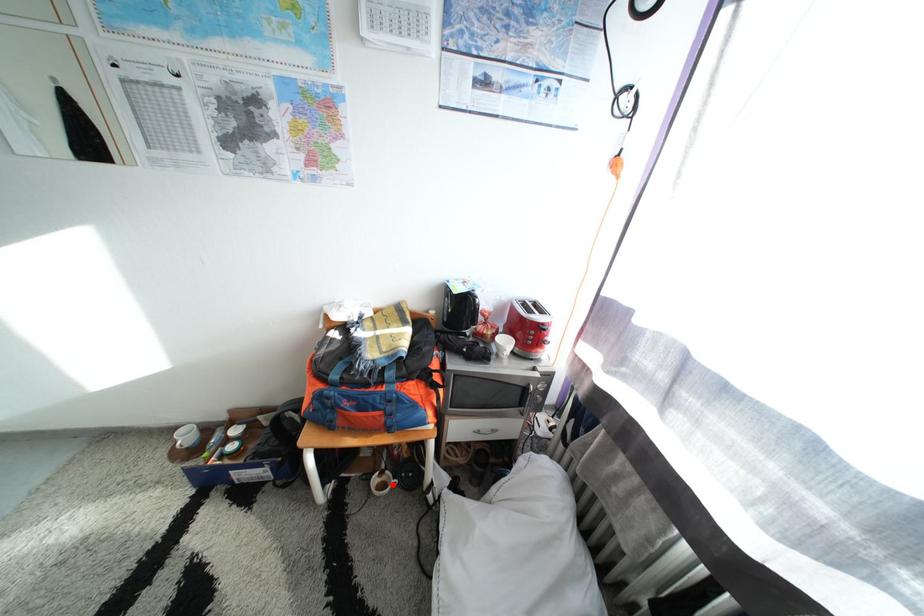
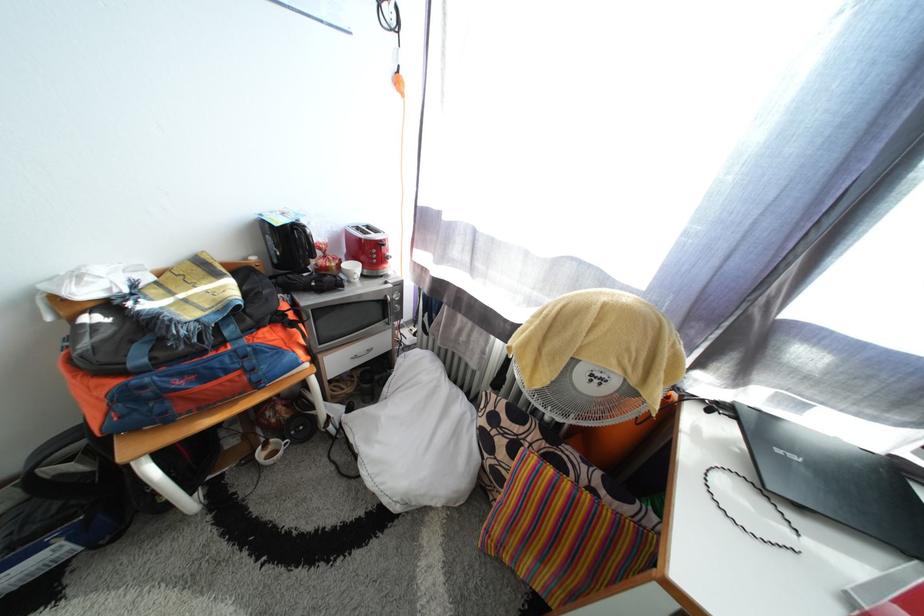
Locate, in the second image, the point that corresponds to the highlighted location in the first image.

(280, 455)